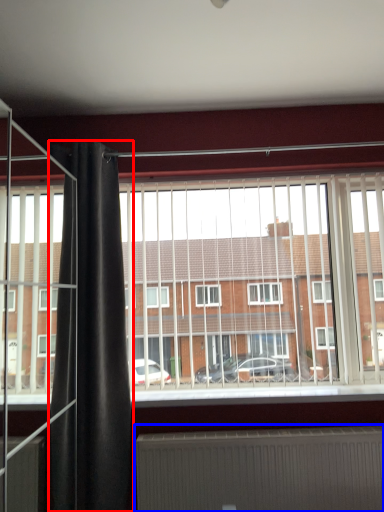
Question: Which object appears closest to the camera in this image, shower curtain (highlighted by a red box) or radiator (highlighted by a blue box)?

Choices:
 (A) shower curtain
 (B) radiator

Answer: (A)